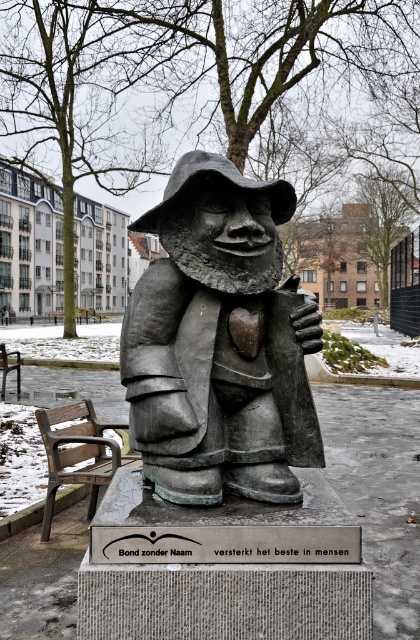
You are standing at the center of the square and want to sit down. Which direction should you walk to reach the wooden bench at lower left?

You should walk towards the lower left direction to reach the wooden bench at lower left.

You are a person who wants to sit on a bench in the park. You see two benches labeled wooden bench at lower left and wooden park bench at lower left. Which one is taller and better suited for someone who prefers higher seating?

The wooden bench at lower left is taller than the wooden park bench at lower left, so it is better suited for someone who prefers higher seating.